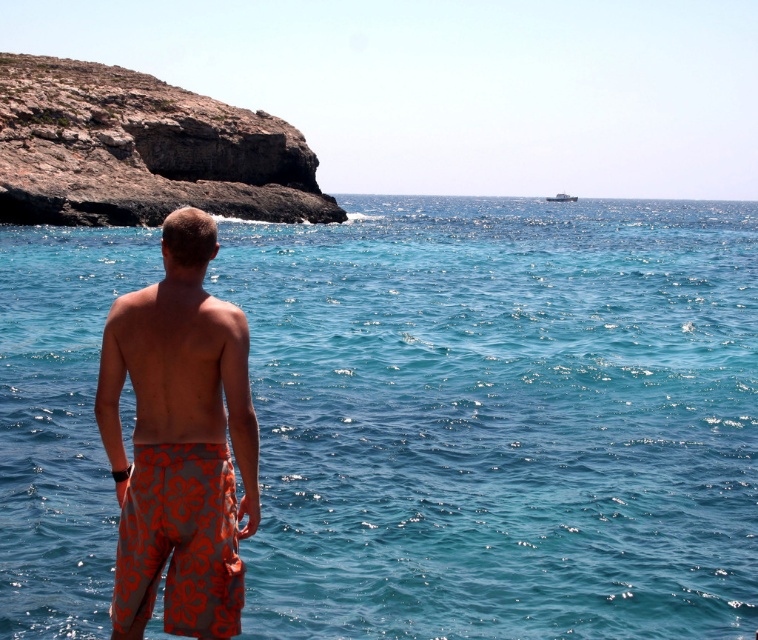
You are a photographer planning to take a picture of the coastal scene. You want to ensure that the translucent blue water at center is in focus. Given that your camera can only focus on a single point, would focusing at point (500,417) help achieve this?

Yes, focusing at point 0.652, 0.662 will ensure the translucent blue water at center is in focus because the point corresponds to that area.

You are a photographer trying to capture the perfect shot of the coastal scene. You notice two points of interest in the image, one at point (312, 196) and the other at point (186, 509). Which point is closer to the camera and should be prioritized for focus?

Point (312, 196) is closer to the camera than point (186, 509), so it should be prioritized for focus.